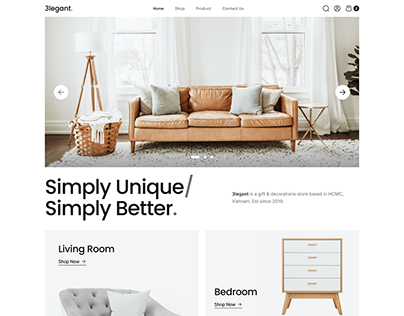
This screenshot has width=404, height=316. What are the coordinates of `standing lamp` in the screenshot? It's located at (92, 58).